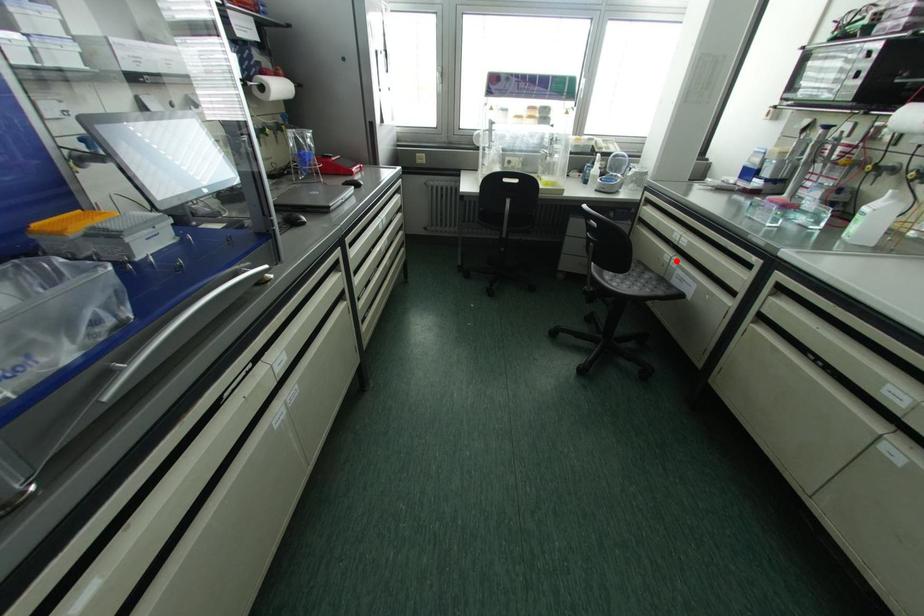
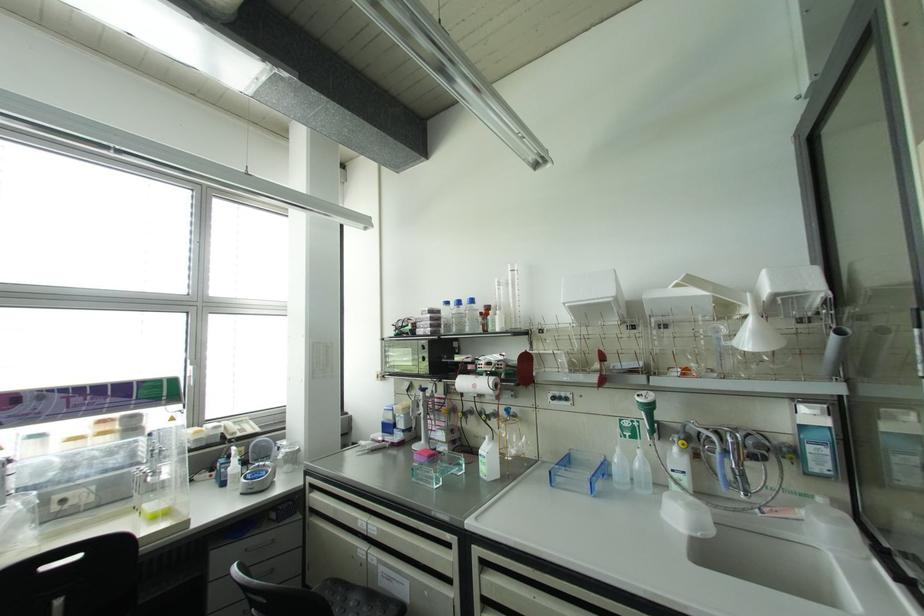
In the second image, find the point that corresponds to the highlighted location in the first image.

(373, 554)